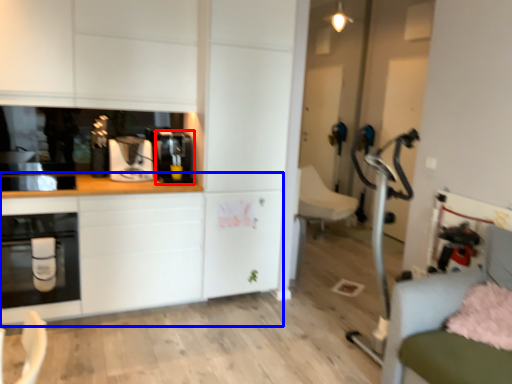
Question: Which object is closer to the camera taking this photo, coffee machine (highlighted by a red box) or counter top (highlighted by a blue box)?

Choices:
 (A) coffee machine
 (B) counter top

Answer: (B)